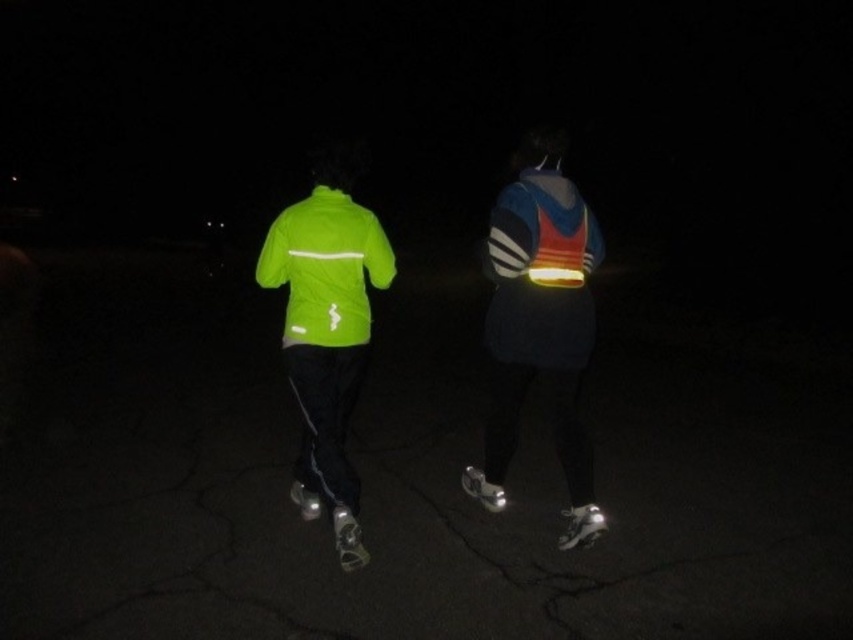
Question: Which of the following is the farthest from the observer?

Choices:
 (A) (321, 157)
 (B) (352, 520)

Answer: (A)

Question: Is neon green jacket at center thinner than reflective orange safety vest at center?

Choices:
 (A) yes
 (B) no

Answer: (B)

Question: Observing the image, what is the correct spatial positioning of neon green jacket at center in reference to shiny silver roller skate at lower center?

Choices:
 (A) left
 (B) right

Answer: (A)

Question: Which object is farther from the camera taking this photo?

Choices:
 (A) neon green jacket at center
 (B) shiny silver roller skate at lower center

Answer: (A)

Question: Among these points, which one is nearest to the camera?

Choices:
 (A) (335, 216)
 (B) (492, 323)

Answer: (A)

Question: Can you confirm if reflective orange safety vest at center is bigger than shiny silver roller skate at lower center?

Choices:
 (A) yes
 (B) no

Answer: (A)